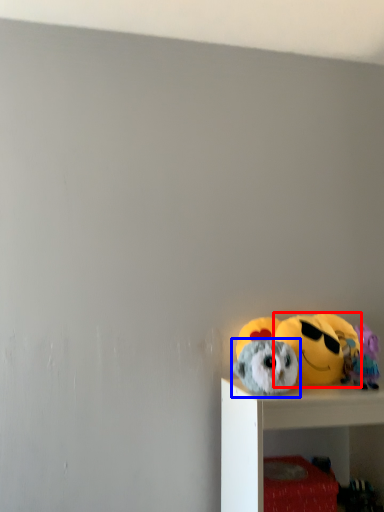
Question: Which object appears closest to the camera in this image, toy (highlighted by a red box) or toy (highlighted by a blue box)?

Choices:
 (A) toy
 (B) toy

Answer: (B)